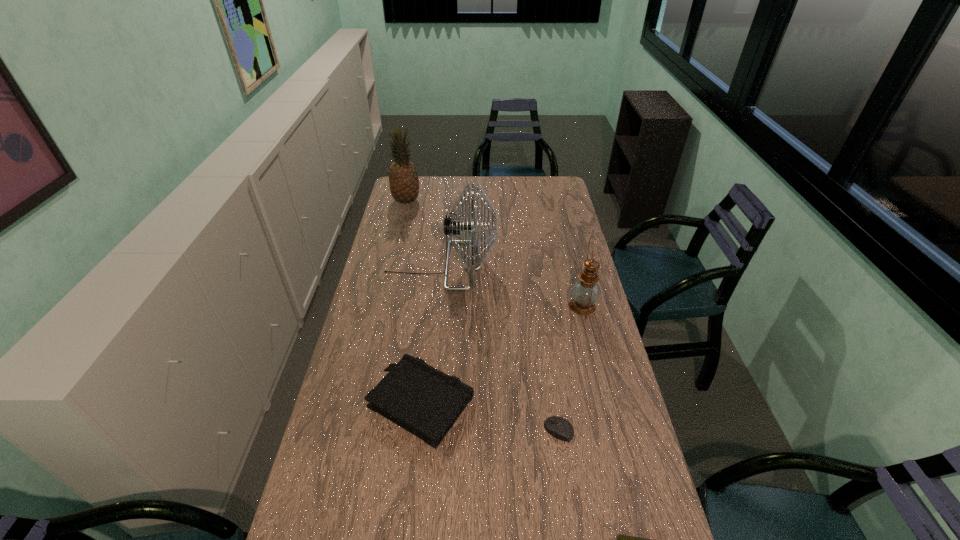
The width and height of the screenshot is (960, 540). Find the location of `vacant region between the oil lamp and the farthest object`. vacant region between the oil lamp and the farthest object is located at coordinates (494, 254).

Identify the location of vacant area that lies between the oil lamp and the fourth object from left to right. [x=571, y=368].

Select which object appears as the second closest to the third tallest object. Please provide its 2D coordinates. Your answer should be formatted as a tuple, i.e. [(x, y)], where the tuple contains the x and y coordinates of a point satisfying the conditions above.

[(426, 402)]

Where is `the fifth closest object to the fourth tallest object`? the fifth closest object to the fourth tallest object is located at coordinates (403, 178).

Where is `free location that satisfies the following two spatial constraints: 1. on the front side of the fifth tallest object; 2. on the right side of the Bible`? The image size is (960, 540). free location that satisfies the following two spatial constraints: 1. on the front side of the fifth tallest object; 2. on the right side of the Bible is located at coordinates (419, 430).

This screenshot has width=960, height=540. I want to click on vacant space that satisfies the following two spatial constraints: 1. on the front-facing side of the fan; 2. on the right side of the fourth shortest object, so click(x=437, y=307).

Locate an element on the screen. free location that satisfies the following two spatial constraints: 1. on the back side of the third tallest object; 2. on the front-facing side of the fan is located at coordinates (572, 266).